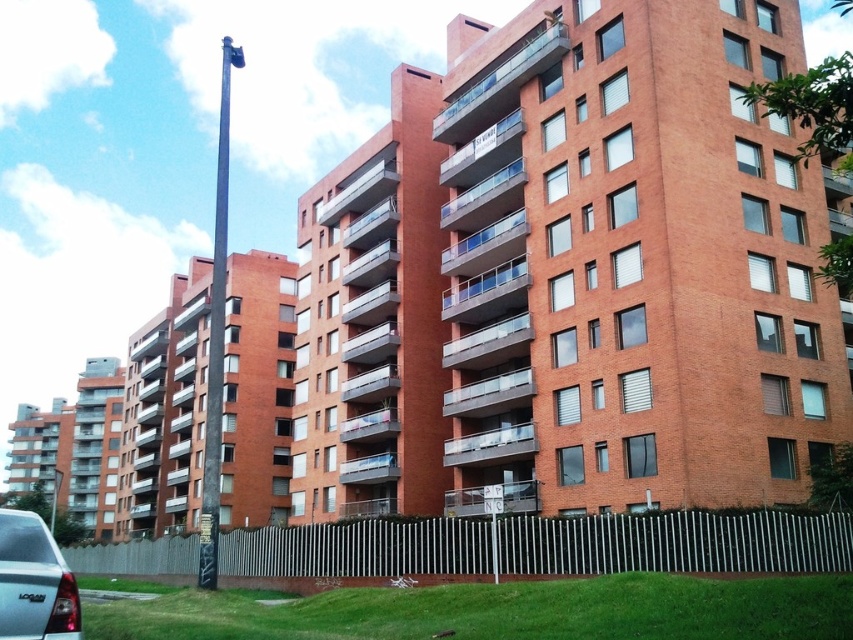
You are a delivery person trying to park your matte black car at lower left. There is a black metal pole at center in the way. Can you fit your car between the pole and the white picket fence without hitting either?

The matte black car at lower left is smaller than the black metal pole at center. Since the car is smaller, it can likely fit between the pole and the white picket fence without hitting either, provided there is sufficient space. However, the exact clearance depends on the pole and fence positions not described here.

You are a delivery driver who needs to park your truck between the matte black car at lower left and the black metal pole at center. Your truck is 20 feet long. Is there enough space between them for your truck?

The distance between the matte black car at lower left and the black metal pole at center is 454.34 feet, so yes, there is enough space for the truck since it is much longer than the truck.

You are a delivery person approaching the residential complex and need to park your matte black car at lower left. The parking spot is directly in front of the black metal pole at center. Can you park there without moving the pole?

The matte black car at lower left is located below the black metal pole at center, meaning the pole is in front of the car. To park in front of the pole, you would need to move it out of the way first.